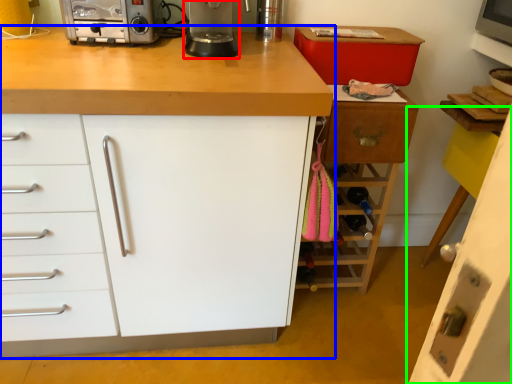
Question: Which object is positioned closest to kitchen appliance (highlighted by a red box)? Select from cabinetry (highlighted by a blue box) and cabinetry (highlighted by a green box).

Choices:
 (A) cabinetry
 (B) cabinetry

Answer: (A)